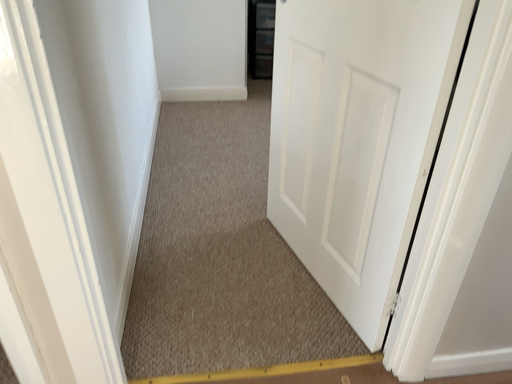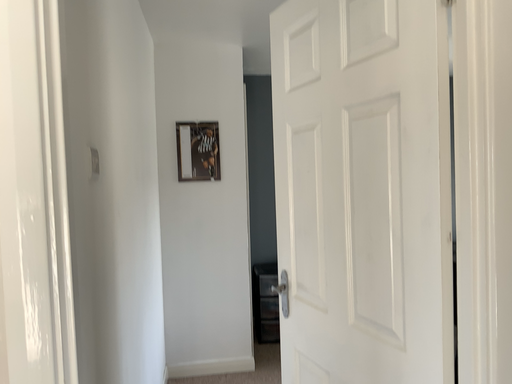
Question: Which way did the camera rotate in the video?

Choices:
 (A) rotated downward
 (B) rotated upward

Answer: (B)